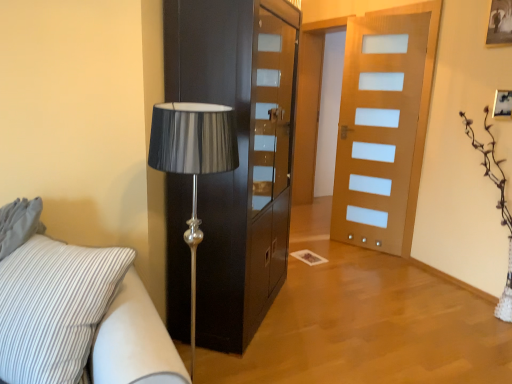
What do you see at coordinates (383, 128) in the screenshot? The width and height of the screenshot is (512, 384). I see `wooden door at center` at bounding box center [383, 128].

The height and width of the screenshot is (384, 512). What do you see at coordinates (239, 153) in the screenshot?
I see `black glossy cabinet at center` at bounding box center [239, 153].

Where is `white striped fabric studio couch at lower left`? The width and height of the screenshot is (512, 384). white striped fabric studio couch at lower left is located at coordinates (75, 311).

I want to click on wooden door at center, so click(x=383, y=128).

Which is behind, point (35, 226) or point (275, 203)?

The point (275, 203) is behind.

Is white striped fabric studio couch at lower left situated inside black glossy cabinet at center or outside?

white striped fabric studio couch at lower left is not enclosed by black glossy cabinet at center.

From the image's perspective, who appears lower, white striped fabric studio couch at lower left or black glossy cabinet at center?

From the image's view, white striped fabric studio couch at lower left is below.

Is white striped fabric studio couch at lower left wider than black glossy cabinet at center?

Indeed, white striped fabric studio couch at lower left has a greater width compared to black glossy cabinet at center.

Considering the sizes of objects wooden door at center and wooden picture frame at upper right in the image provided, who is shorter, wooden door at center or wooden picture frame at upper right?

wooden picture frame at upper right is shorter.

Is wooden door at center aimed at wooden picture frame at upper right?

No, wooden door at center is not facing towards wooden picture frame at upper right.

Could wooden picture frame at upper right be considered to be inside wooden door at center?

Definitely not — wooden picture frame at upper right is not inside wooden door at center.

Considering the relative sizes of white striped fabric studio couch at lower left and wooden door at center in the image provided, is white striped fabric studio couch at lower left shorter than wooden door at center?

Yes, white striped fabric studio couch at lower left is shorter than wooden door at center.

Which point is more distant from viewer, (24,350) or (421,22)?

The point (421,22) is farther.

Considering the relative sizes of white striped fabric studio couch at lower left and wooden door at center in the image provided, is white striped fabric studio couch at lower left smaller than wooden door at center?

Actually, white striped fabric studio couch at lower left might be larger than wooden door at center.

Based on the photo, is the position of white striped fabric studio couch at lower left less distant than that of wooden door at center?

Yes, white striped fabric studio couch at lower left is in front of wooden door at center.

Is point (511, 94) closer or farther from the camera than point (379, 225)?

Point (511, 94).

From a real-world perspective, is wooden picture frame at upper right above or below wooden door at center?

In terms of real-world spatial position, wooden picture frame at upper right is above wooden door at center.

Between wooden picture frame at upper right and wooden door at center, which one appears on the right side from the viewer's perspective?

Positioned to the right is wooden picture frame at upper right.

Is wooden picture frame at upper right far away from wooden door at center?

Absolutely, wooden picture frame at upper right is distant from wooden door at center.

Between wooden door at center and black glossy cabinet at center, which one has less height?

black glossy cabinet at center.

Looking at this image, is wooden door at center at the left side of black glossy cabinet at center?

No.

From the image's perspective, is wooden door at center located above or below black glossy cabinet at center?

From the image's perspective, wooden door at center appears above black glossy cabinet at center.

Is white striped fabric studio couch at lower left further to the viewer compared to wooden picture frame at upper right?

No, it is in front of wooden picture frame at upper right.

Considering the sizes of white striped fabric studio couch at lower left and wooden picture frame at upper right in the image, is white striped fabric studio couch at lower left bigger or smaller than wooden picture frame at upper right?

In the image, white striped fabric studio couch at lower left appears to be larger than wooden picture frame at upper right.

Can you confirm if white striped fabric studio couch at lower left is positioned to the left of wooden picture frame at upper right?

Correct, you'll find white striped fabric studio couch at lower left to the left of wooden picture frame at upper right.

Is wooden picture frame at upper right oriented away from black glossy cabinet at center?

No.

Measure the distance from wooden picture frame at upper right to black glossy cabinet at center.

wooden picture frame at upper right and black glossy cabinet at center are 1.88 meters apart.

Can black glossy cabinet at center be found inside wooden picture frame at upper right?

No, black glossy cabinet at center is not surrounded by wooden picture frame at upper right.

Is point (506, 112) closer or farther from the camera than point (289, 159)?

Clearly, point (506, 112) is closer to the camera than point (289, 159).

Locate an element on the screen. studio couch in front of the black glossy cabinet at center is located at coordinates (75, 311).

Find the location of a particular element. picture frame above the wooden door at center (from a real-world perspective) is located at coordinates (502, 103).

Which object lies further to the anchor point black glossy cabinet at center, white striped fabric studio couch at lower left or wooden picture frame at upper right?

wooden picture frame at upper right is further to black glossy cabinet at center.

From the image, which object appears to be farther from wooden picture frame at upper right, black glossy cabinet at center or wooden door at center?

black glossy cabinet at center.

When comparing their distances from wooden door at center, does wooden picture frame at upper right or black glossy cabinet at center seem closer?

wooden picture frame at upper right.

Looking at the image, which one is located closer to wooden picture frame at upper right, white striped fabric studio couch at lower left or black glossy cabinet at center?

black glossy cabinet at center is positioned closer to the anchor wooden picture frame at upper right.

From the image, which object appears to be farther from black glossy cabinet at center, wooden picture frame at upper right or wooden door at center?

Among the two, wooden picture frame at upper right is located further to black glossy cabinet at center.

Based on their spatial positions, is wooden door at center or wooden picture frame at upper right closer to black glossy cabinet at center?

Based on the image, wooden door at center appears to be nearer to black glossy cabinet at center.

Which object lies nearer to the anchor point white striped fabric studio couch at lower left, wooden door at center or black glossy cabinet at center?

black glossy cabinet at center is positioned closer to the anchor white striped fabric studio couch at lower left.

From the image, which object appears to be nearer to wooden picture frame at upper right, wooden door at center or black glossy cabinet at center?

The object closer to wooden picture frame at upper right is wooden door at center.

Image resolution: width=512 pixels, height=384 pixels. What are the coordinates of `door between white striped fabric studio couch at lower left and wooden picture frame at upper right` in the screenshot? It's located at (383, 128).

Where is `door between black glossy cabinet at center and wooden picture frame at upper right in the horizontal direction`? The image size is (512, 384). door between black glossy cabinet at center and wooden picture frame at upper right in the horizontal direction is located at coordinates [x=383, y=128].

At what (x,y) coordinates should I click in order to perform the action: click on cabinetry located between white striped fabric studio couch at lower left and wooden picture frame at upper right in the left-right direction. Please return your answer as a coordinate pair (x, y). Looking at the image, I should click on (239, 153).

Identify the location of cabinetry between white striped fabric studio couch at lower left and wooden door at center from front to back. (239, 153).